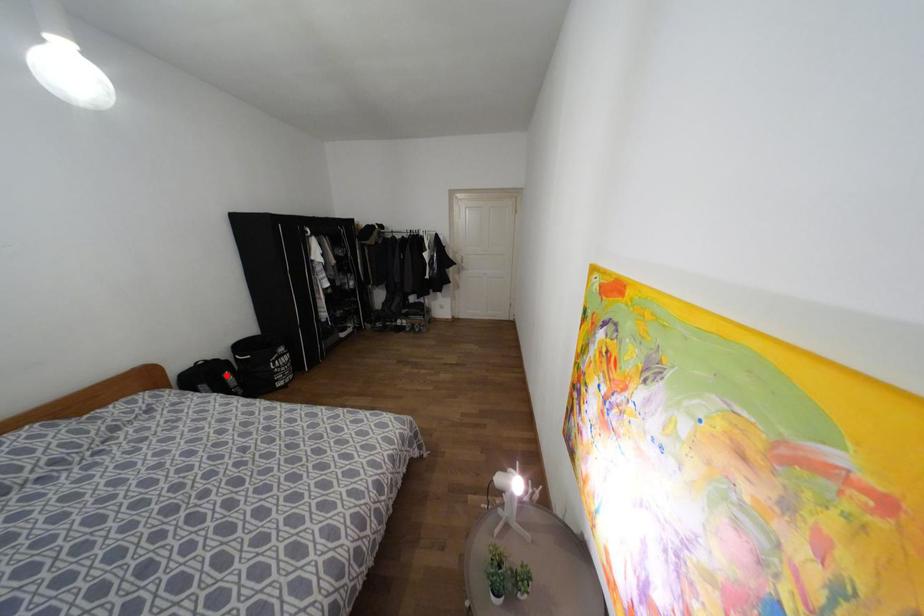
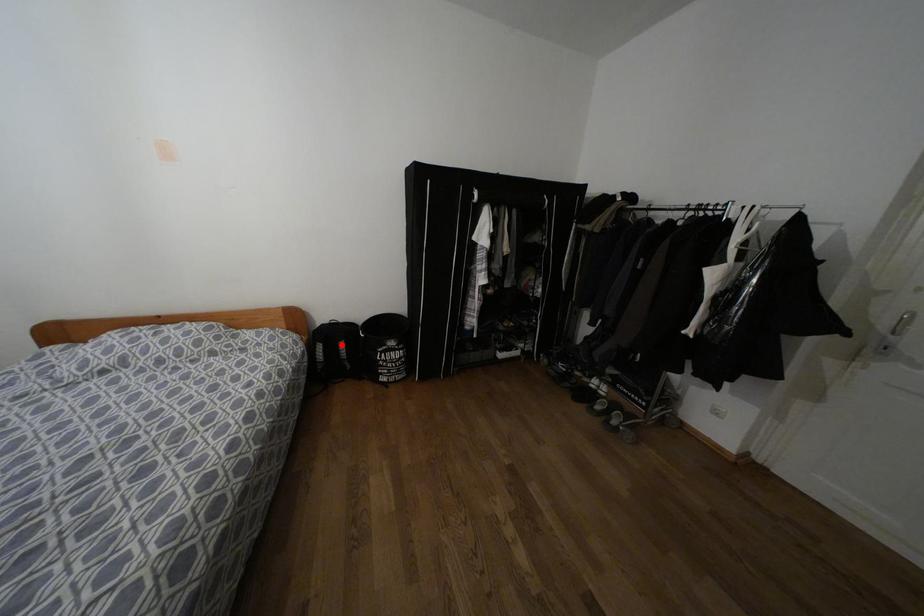
I am providing you with two images of the same scene from different viewpoints. A red point is marked on the first image and another point is marked on the second image. Is the red point in image1 aligned with the point shown in image2?

Yes